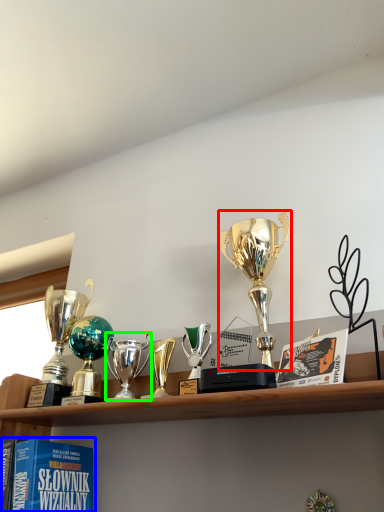
Question: Which object is the closest to the trophy (highlighted by a red box)? Choose among these: book (highlighted by a blue box) or trophy (highlighted by a green box).

Choices:
 (A) book
 (B) trophy

Answer: (B)